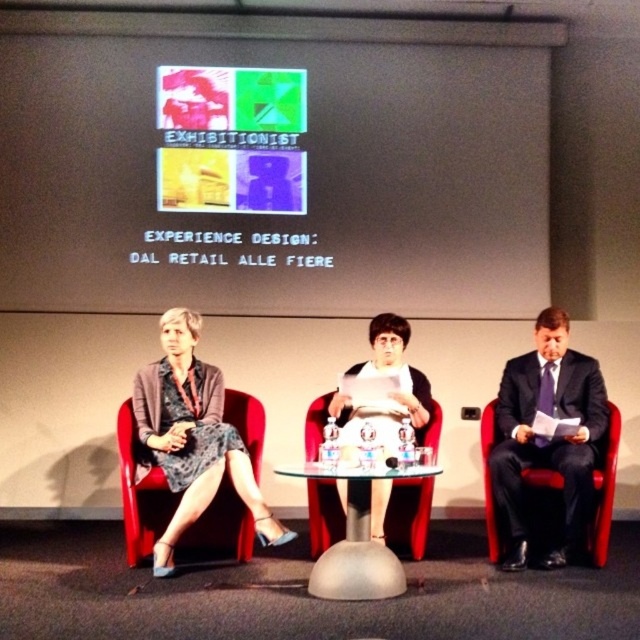
Looking at this image, which is more to the left, transparent glass chair at center or red leather chair at right?

From the viewer's perspective, transparent glass chair at center appears more on the left side.

Which is above, transparent glass chair at center or red leather chair at right?

Positioned higher is red leather chair at right.

The height and width of the screenshot is (640, 640). Identify the location of transparent glass chair at center. (408, 516).

Between matte fabric chair at left and transparent glass table at center, which one appears on the left side from the viewer's perspective?

Positioned to the left is matte fabric chair at left.

Which of these two, matte fabric chair at left or transparent glass table at center, stands taller?

matte fabric chair at left

Image resolution: width=640 pixels, height=640 pixels. Find the location of `matte fabric chair at left`. matte fabric chair at left is located at coordinates (140, 492).

Is point (515, 161) behind point (170, 493)?

Yes.

Is white matte projection screen at upper center thinner than matte fabric chair at left?

In fact, white matte projection screen at upper center might be wider than matte fabric chair at left.

Which is in front, point (248, 266) or point (218, 532)?

Positioned in front is point (218, 532).

The height and width of the screenshot is (640, 640). I want to click on white matte projection screen at upper center, so click(273, 163).